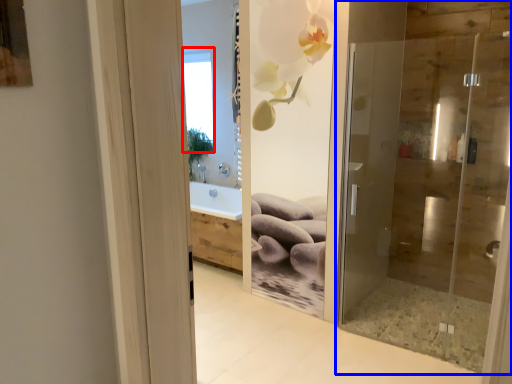
Question: Which of the following is the farthest to the observer, window (highlighted by a red box) or door (highlighted by a blue box)?

Choices:
 (A) window
 (B) door

Answer: (A)